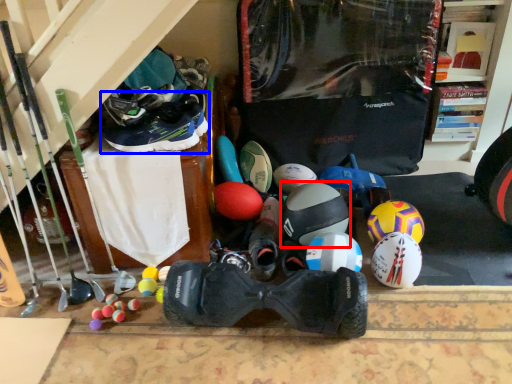
Question: Which point is closer to the camera, helmet (highlighted by a red box) or footwear (highlighted by a blue box)?

Choices:
 (A) helmet
 (B) footwear

Answer: (B)